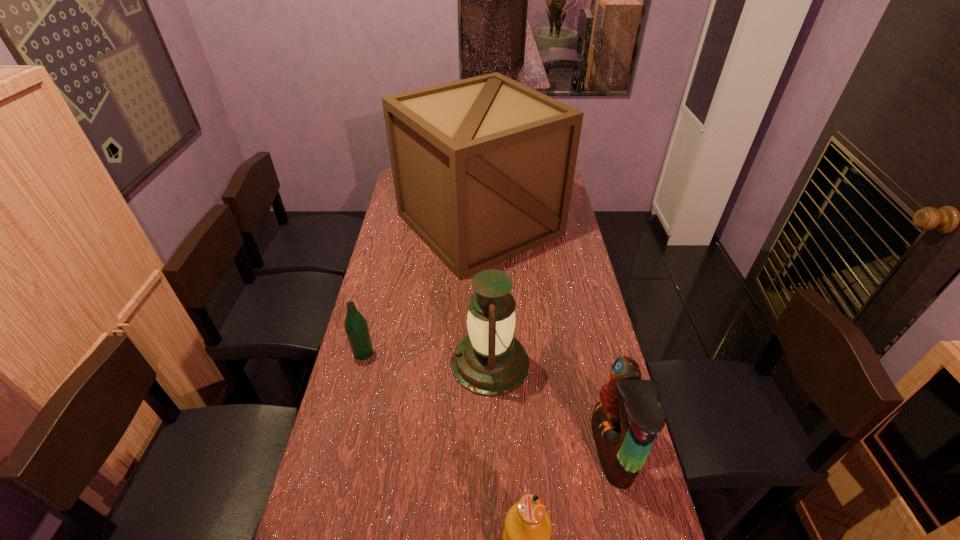
What are the coordinates of `vacant space located 0.190m at the face of the parrot` in the screenshot? It's located at (524, 450).

This screenshot has width=960, height=540. In order to click on free region located 0.340m at the face of the parrot in this screenshot , I will do (469, 450).

Image resolution: width=960 pixels, height=540 pixels. I want to click on blank area located on the front of the bottle, so click(331, 484).

Where is `object that is at the far edge`? This screenshot has height=540, width=960. object that is at the far edge is located at coordinates (483, 168).

Where is `box located in the left edge section of the desktop`? box located in the left edge section of the desktop is located at coordinates (483, 168).

I want to click on bottle that is positioned at the left edge, so click(x=356, y=327).

In order to click on box at the right edge in this screenshot , I will do `click(483, 168)`.

Locate an element on the screen. The image size is (960, 540). parrot that is at the right edge is located at coordinates (628, 418).

At what (x,y) coordinates should I click in order to perform the action: click on object at the far left corner. Please return your answer as a coordinate pair (x, y). Image resolution: width=960 pixels, height=540 pixels. Looking at the image, I should click on (483, 168).

At what (x,y) coordinates should I click in order to perform the action: click on object that is positioned at the far right corner. Please return your answer as a coordinate pair (x, y). This screenshot has height=540, width=960. Looking at the image, I should click on (483, 168).